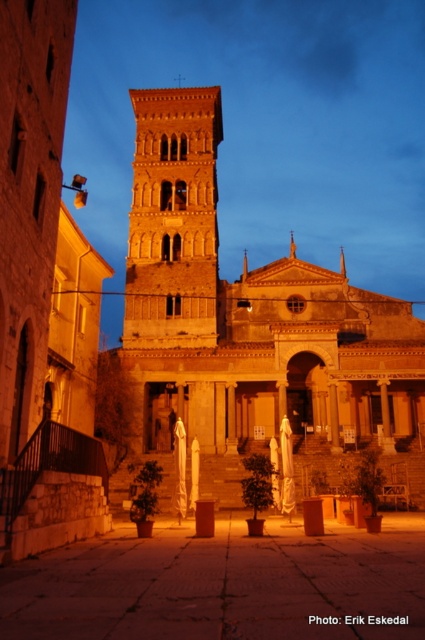
Which of these two, golden stone church at center or brown stone alley at center, stands shorter?

brown stone alley at center

Can you confirm if golden stone church at center is positioned below brown stone alley at center?

Incorrect, golden stone church at center is not positioned below brown stone alley at center.

The width and height of the screenshot is (425, 640). In order to click on golden stone church at center in this screenshot , I will do `click(249, 326)`.

Identify the location of brown stone alley at center. (221, 584).

Can you confirm if brown stone alley at center is positioned to the right of golden stone tower at center?

Yes, brown stone alley at center is to the right of golden stone tower at center.

Does point (153, 568) come farther from viewer compared to point (195, 292)?

No, (153, 568) is in front of (195, 292).

Image resolution: width=425 pixels, height=640 pixels. What are the coordinates of `brown stone alley at center` in the screenshot? It's located at pyautogui.click(x=221, y=584).

Is point (260, 307) positioned behind point (127, 256)?

No, (260, 307) is closer to viewer.

Between point (306, 397) and point (164, 115), which one is positioned in front?

Point (306, 397) is in front.

Locate an element on the screen. golden stone church at center is located at coordinates (249, 326).